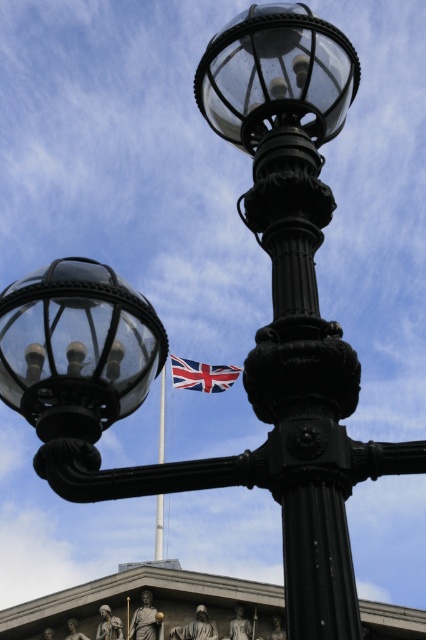
Describe the element at coordinates (77, 349) in the screenshot. This screenshot has width=426, height=640. I see `matte glass streetlamp at upper center` at that location.

Does matte glass streetlamp at upper center have a lesser height compared to metallic flag pole at center?

Correct, matte glass streetlamp at upper center is not as tall as metallic flag pole at center.

Where is `matte glass streetlamp at upper center`? The image size is (426, 640). matte glass streetlamp at upper center is located at coordinates (77, 349).

The height and width of the screenshot is (640, 426). Find the location of `matte glass streetlamp at upper center`. matte glass streetlamp at upper center is located at coordinates (77, 349).

Which is behind, point (48, 300) or point (233, 365)?

Point (233, 365)

Can you confirm if matte glass streetlamp at upper center is smaller than red and white striped fabric at center?

Yes, matte glass streetlamp at upper center is smaller than red and white striped fabric at center.

Is point (8, 376) behind point (173, 385)?

No.

This screenshot has width=426, height=640. Identify the location of matte glass streetlamp at upper center. (77, 349).

Does red and white striped fabric at center appear on the right side of metallic flag pole at center?

Yes, red and white striped fabric at center is to the right of metallic flag pole at center.

Is red and white striped fabric at center thinner than metallic flag pole at center?

Yes, red and white striped fabric at center is thinner than metallic flag pole at center.

Describe the element at coordinates (201, 374) in the screenshot. The width and height of the screenshot is (426, 640). I see `red and white striped fabric at center` at that location.

Find the location of a particular element. red and white striped fabric at center is located at coordinates (201, 374).